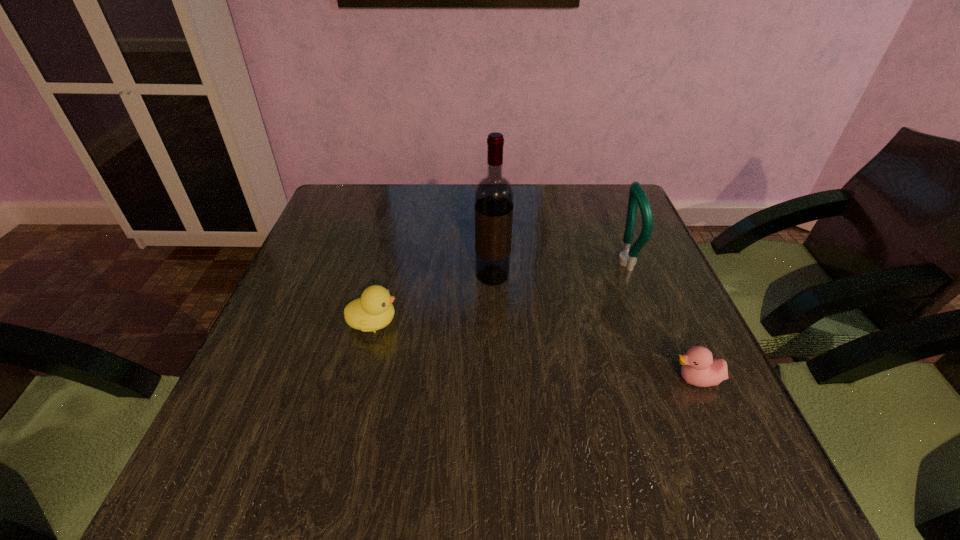
At what (x,y) coordinates should I click in order to perform the action: click on vacant area situated at the jaws of the bottle opener. Please return your answer as a coordinate pair (x, y). The image size is (960, 540). Looking at the image, I should click on (492, 262).

Where is `vacant region located at the beak of the third farthest object`? This screenshot has height=540, width=960. vacant region located at the beak of the third farthest object is located at coordinates (509, 322).

Locate an element on the screen. The width and height of the screenshot is (960, 540). vacant space situated on the front-facing side of the right duckling is located at coordinates (454, 380).

You are a GUI agent. You are given a task and a screenshot of the screen. Output one action in this format:
    pyautogui.click(x=<x>, y=<y>)
    Task: Click on the free space located on the front-facing side of the right duckling
    
    Given the screenshot: What is the action you would take?
    pyautogui.click(x=563, y=380)

Locate an element on the screen. Image resolution: width=960 pixels, height=540 pixels. blank space located 0.180m on the front-facing side of the right duckling is located at coordinates (573, 380).

This screenshot has width=960, height=540. Identify the location of bottle opener present at the right edge. (637, 197).

Find the location of a particular element. The image size is (960, 540). duckling that is at the right edge is located at coordinates (699, 368).

The width and height of the screenshot is (960, 540). In order to click on free region at the far edge in this screenshot , I will do `click(457, 199)`.

The image size is (960, 540). In the image, there is a desktop. Identify the location of vacant space at the near edge. (411, 496).

The height and width of the screenshot is (540, 960). What are the coordinates of `vacant space at the left edge of the desktop` in the screenshot? It's located at [341, 235].